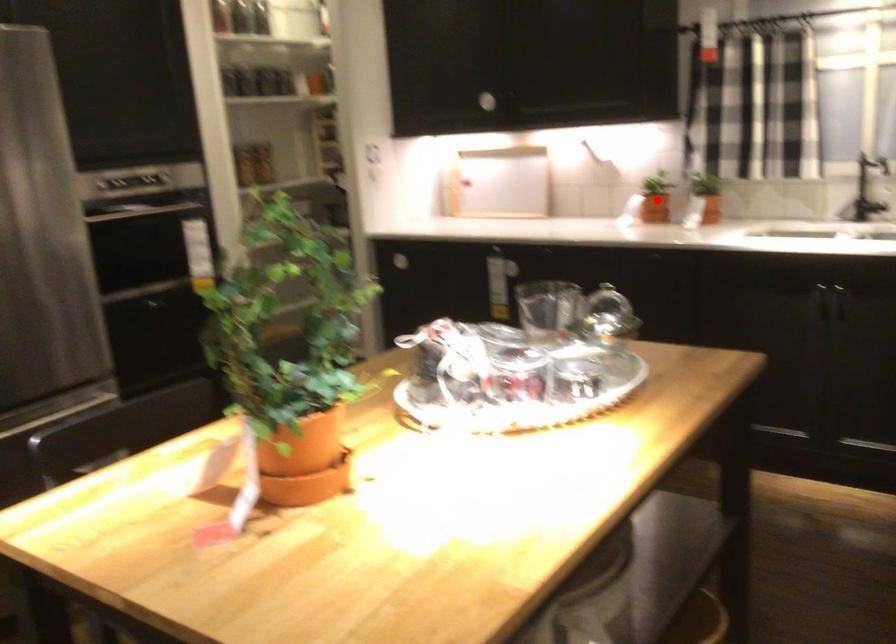
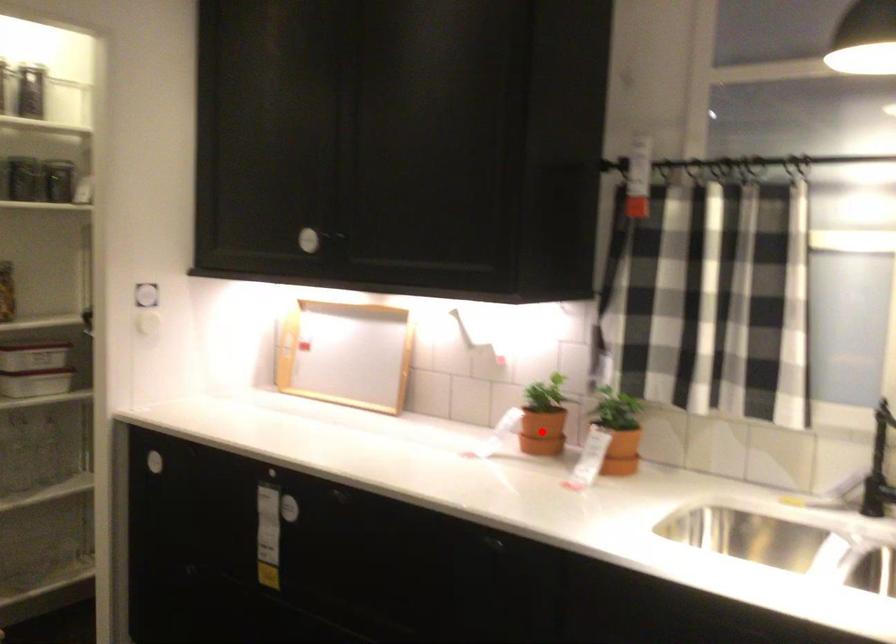
I am providing you with two images of the same scene from different viewpoints. A red point is marked on the first image and another point is marked on the second image. Does the point marked in image1 correspond to the same location as the one in image2?

Yes